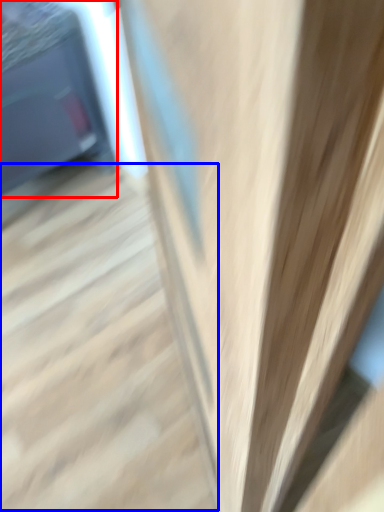
Question: Which object appears farthest to the camera in this image, furniture (highlighted by a red box) or stairs (highlighted by a blue box)?

Choices:
 (A) furniture
 (B) stairs

Answer: (A)